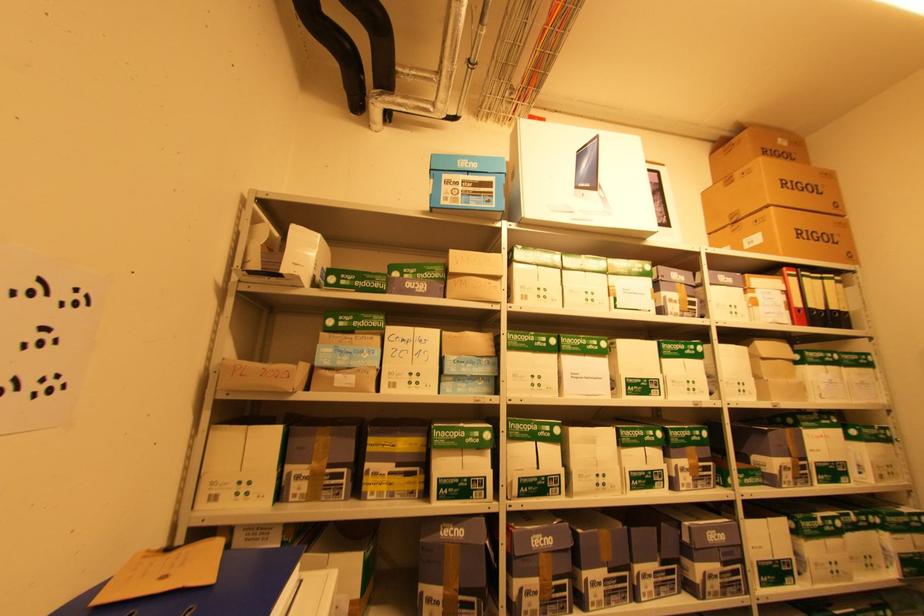
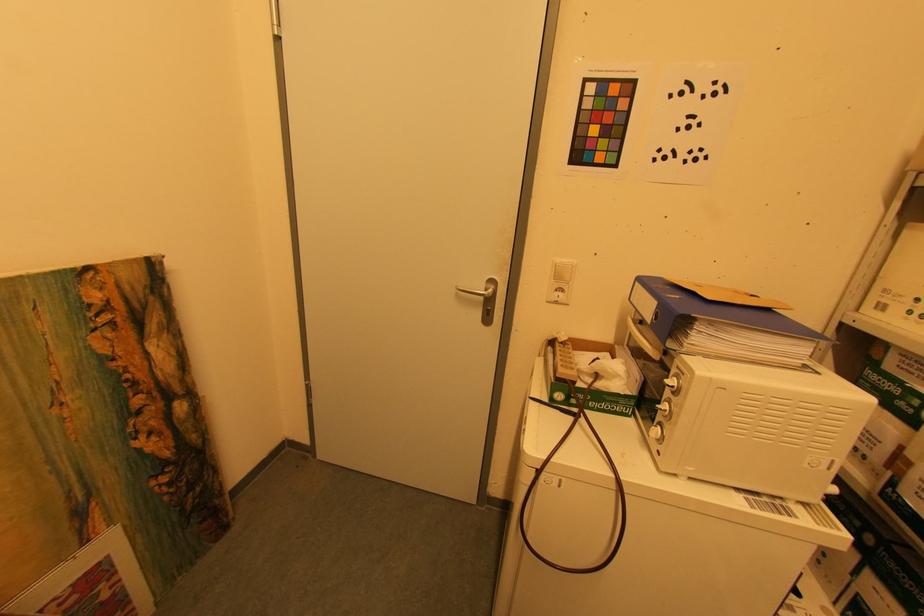
Question: The camera is either moving clockwise (left) or counter-clockwise (right) around the object. The first image is from the beginning of the video and the second image is from the end. Is the camera moving left or right when shooting the video?

Choices:
 (A) Left
 (B) Right

Answer: (B)